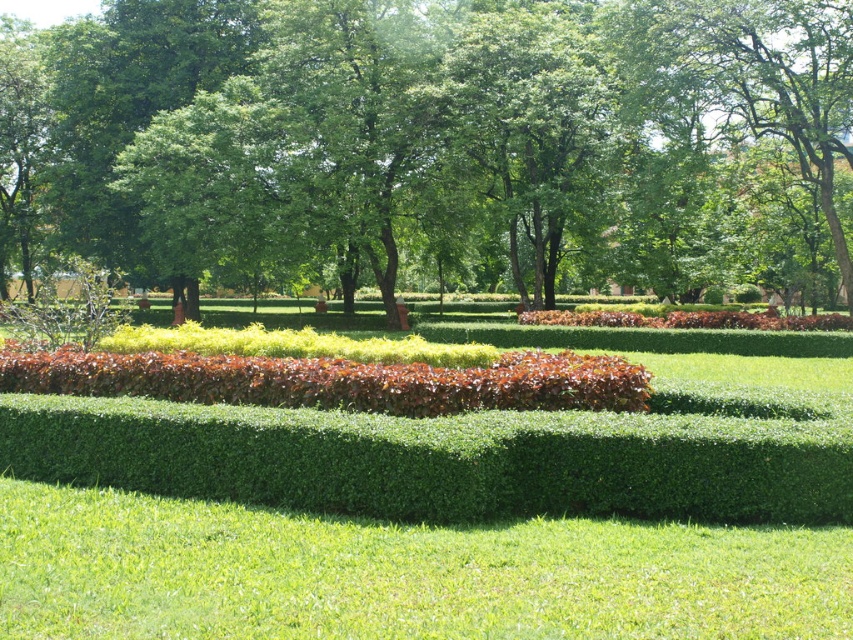
Which is above, green leafy grass at center or brown textured shrubbery at center?

brown textured shrubbery at center is above.

Is green leafy grass at center taller than brown textured shrubbery at center?

Incorrect, green leafy grass at center's height is not larger of brown textured shrubbery at center's.

You are a GUI agent. You are given a task and a screenshot of the screen. Output one action in this format:
    pyautogui.click(x=<x>, y=<y>)
    Task: Click on the green leafy grass at center
    
    Given the screenshot: What is the action you would take?
    pyautogui.click(x=427, y=518)

Based on the photo, is green leafy grass at center above green smooth grass at center?

Correct, green leafy grass at center is located above green smooth grass at center.

Who is taller, green leafy grass at center or green smooth grass at center?

green smooth grass at center is taller.

Between point (527, 456) and point (633, 630), which one is positioned in front?

Point (633, 630) is more forward.

What are the coordinates of `green leafy grass at center` in the screenshot? It's located at point(427,518).

Who is more forward, (175, 499) or (447, 400)?

Positioned in front is point (175, 499).

Does point (224, 506) come behind point (200, 358)?

No, it is in front of (200, 358).

At what (x,y) coordinates should I click in order to perform the action: click on green smooth grass at center. Please return your answer as a coordinate pair (x, y). The height and width of the screenshot is (640, 853). Looking at the image, I should click on (399, 573).